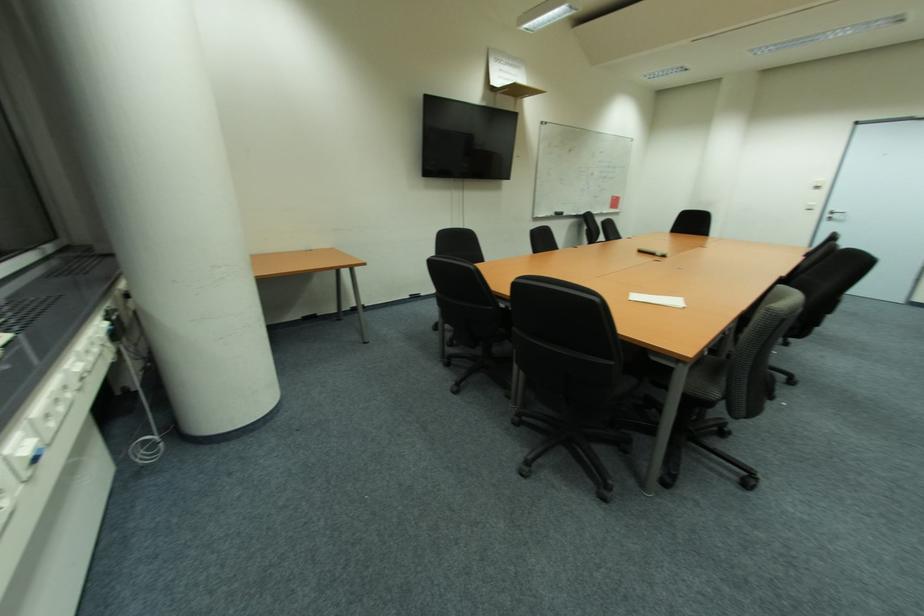
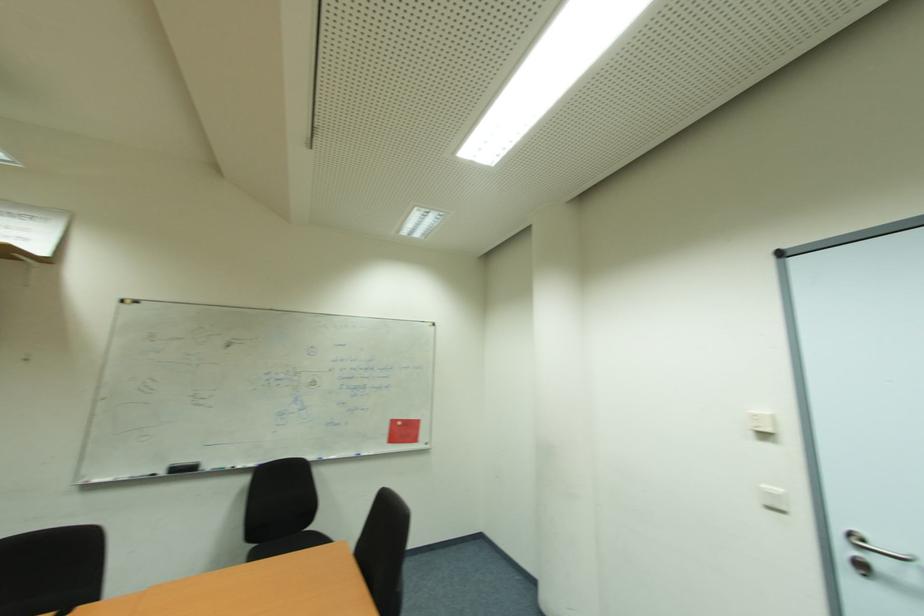
Find the pixel in the second image that matches the point at 564,216 in the first image.

(189, 469)